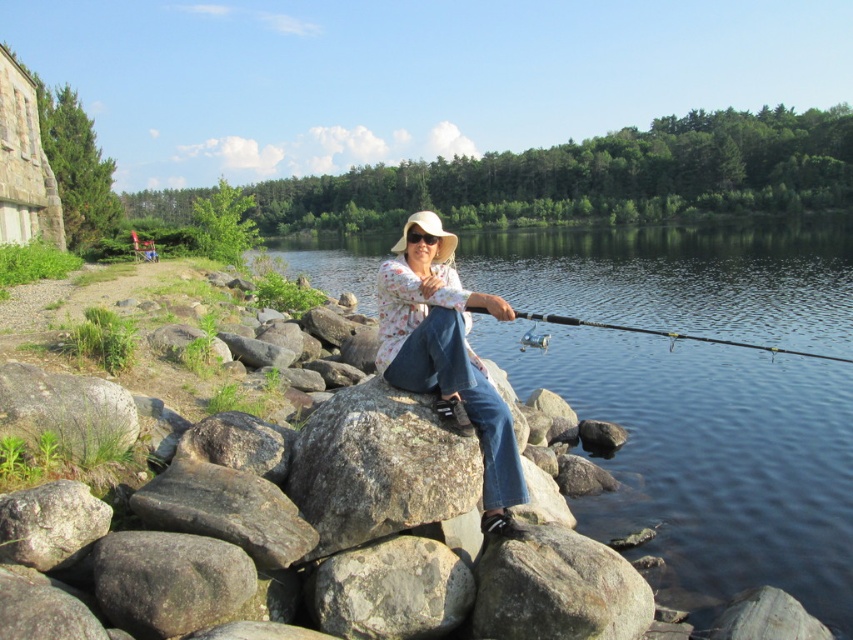
Question: Can you confirm if gray rough rock at lower center is positioned below green grassy rock at lower left?

Choices:
 (A) no
 (B) yes

Answer: (B)

Question: Observing the image, what is the correct spatial positioning of gray rough rock at lower center in reference to green grassy rock at lower left?

Choices:
 (A) left
 (B) right

Answer: (B)

Question: Which point is farther from the camera taking this photo?

Choices:
 (A) (474, 625)
 (B) (393, 618)
 (C) (39, 531)

Answer: (A)

Question: Which object is the closest to the gray rough rock at lower left?

Choices:
 (A) clear water at center
 (B) gray rough rock at lower center

Answer: (B)

Question: Which of these objects is positioned farthest from the gray rough rock at center?

Choices:
 (A) floral cotton shirt at center
 (B) gray rough rock at lower center
 (C) gray rough rock at lower left
 (D) green grassy rock at lower left

Answer: (D)

Question: Can you confirm if clear water at center is positioned below gray rough rock at center?

Choices:
 (A) yes
 (B) no

Answer: (B)